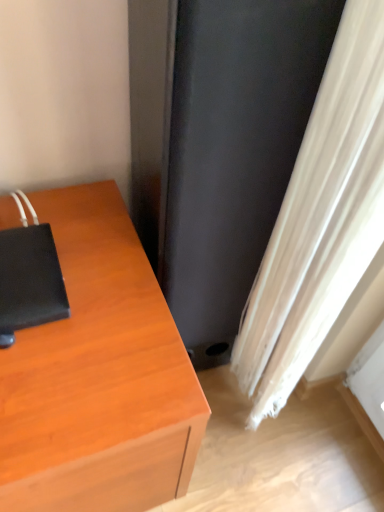
Find the location of `white textured curtain at lower right`. white textured curtain at lower right is located at coordinates (320, 219).

Describe the element at coordinates (234, 151) in the screenshot. Image resolution: width=384 pixels, height=512 pixels. I see `black matte screen door at center` at that location.

Where is `black matte notebook at left`? The width and height of the screenshot is (384, 512). black matte notebook at left is located at coordinates (29, 281).

Is black matte notebook at left touching white textured curtain at lower right?

No, black matte notebook at left is not with white textured curtain at lower right.

Locate an element on the screen. This screenshot has width=384, height=512. notebook lying behind the white textured curtain at lower right is located at coordinates tap(29, 281).

Would you say black matte notebook at left is inside or outside white textured curtain at lower right?

black matte notebook at left cannot be found inside white textured curtain at lower right.

Consider the image. Is white textured curtain at lower right at the back of black matte notebook at left?

No, black matte notebook at left's orientation is not away from white textured curtain at lower right.

Based on the photo, is the position of black matte screen door at center more distant than that of white textured curtain at lower right?

Yes, it is behind white textured curtain at lower right.

From a real-world perspective, is black matte screen door at center on top of white textured curtain at lower right?

No, from a real-world perspective, black matte screen door at center is not on top of white textured curtain at lower right.

The image size is (384, 512). In the image, there is a white textured curtain at lower right. Identify the location of screen door above it (from the image's perspective). (234, 151).

Considering the relative sizes of black matte notebook at left and black matte screen door at center in the image provided, is black matte notebook at left thinner than black matte screen door at center?

Yes.

The height and width of the screenshot is (512, 384). In order to click on screen door located above the black matte notebook at left (from the image's perspective) in this screenshot , I will do [x=234, y=151].

In terms of size, does black matte notebook at left appear bigger or smaller than black matte screen door at center?

Considering their sizes, black matte notebook at left takes up less space than black matte screen door at center.

In the image, is black matte screen door at center positioned in front of or behind black matte notebook at left?

black matte screen door at center is in front of black matte notebook at left.

Is point (279, 49) closer or farther from the camera than point (46, 321)?

Clearly, point (279, 49) is closer to the camera than point (46, 321).

In the scene shown: Who is shorter, black matte screen door at center or black matte notebook at left?

black matte notebook at left.

Is black matte screen door at center turned away from black matte notebook at left?

No, black matte notebook at left is not at the back of black matte screen door at center.

Is black matte screen door at center completely or partially inside white textured curtain at lower right?

No, white textured curtain at lower right does not contain black matte screen door at center.

Does white textured curtain at lower right have a greater height compared to black matte screen door at center?

Indeed, white textured curtain at lower right has a greater height compared to black matte screen door at center.

From the image's perspective, is white textured curtain at lower right above or below black matte screen door at center?

white textured curtain at lower right is below black matte screen door at center.

From a real-world perspective, who is located lower, white textured curtain at lower right or black matte screen door at center?

In real-world perspective, black matte screen door at center is lower.

Looking at this image, is white textured curtain at lower right outside of black matte notebook at left?

white textured curtain at lower right lies outside black matte notebook at left's area.

How much distance is there between white textured curtain at lower right and black matte notebook at left?

A distance of 48.62 centimeters exists between white textured curtain at lower right and black matte notebook at left.

Are white textured curtain at lower right and black matte notebook at left beside each other?

They are not placed beside each other.

Considering the sizes of objects white textured curtain at lower right and black matte notebook at left in the image provided, who is thinner, white textured curtain at lower right or black matte notebook at left?

Thinner between the two is white textured curtain at lower right.

This screenshot has height=512, width=384. Identify the location of notebook above the white textured curtain at lower right (from a real-world perspective). (29, 281).

In order to click on curtain below the black matte screen door at center (from the image's perspective) in this screenshot , I will do `click(320, 219)`.

When comparing their distances from black matte notebook at left, does black matte screen door at center or white textured curtain at lower right seem closer?

black matte screen door at center is closer to black matte notebook at left.

Looking at this image, when comparing their distances from black matte screen door at center, does black matte notebook at left or white textured curtain at lower right seem further?

black matte notebook at left is further to black matte screen door at center.

Which object lies nearer to the anchor point black matte screen door at center, white textured curtain at lower right or black matte notebook at left?

The object closer to black matte screen door at center is white textured curtain at lower right.

From the image, which object appears to be farther from white textured curtain at lower right, black matte screen door at center or black matte notebook at left?

Based on the image, black matte notebook at left appears to be further to white textured curtain at lower right.

Which object lies further to the anchor point white textured curtain at lower right, black matte notebook at left or black matte screen door at center?

black matte notebook at left.

From the image, which object appears to be nearer to black matte notebook at left, white textured curtain at lower right or black matte screen door at center?

The object closer to black matte notebook at left is black matte screen door at center.

Find the location of `screen door situated between black matte notebook at left and white textured curtain at lower right from left to right`. screen door situated between black matte notebook at left and white textured curtain at lower right from left to right is located at coordinates (234, 151).